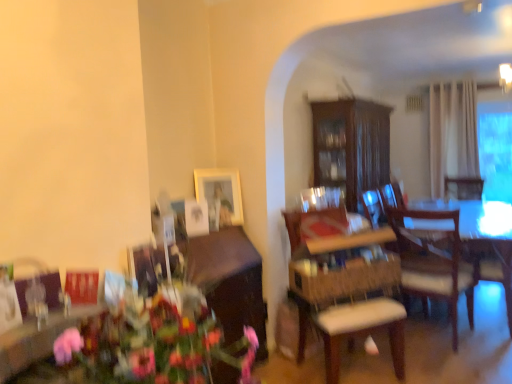
Question: Is matte wooden picture frame at upper center thinner than wooden armchair at right?

Choices:
 (A) no
 (B) yes

Answer: (B)

Question: From a real-world perspective, is matte wooden picture frame at upper center located beneath wooden armchair at right?

Choices:
 (A) no
 (B) yes

Answer: (A)

Question: Can we say matte wooden picture frame at upper center lies outside wooden armchair at right?

Choices:
 (A) no
 (B) yes

Answer: (B)

Question: Considering the relative sizes of matte wooden picture frame at upper center and wooden armchair at right in the image provided, is matte wooden picture frame at upper center bigger than wooden armchair at right?

Choices:
 (A) no
 (B) yes

Answer: (A)

Question: Is matte wooden picture frame at upper center to the right of wooden armchair at right from the viewer's perspective?

Choices:
 (A) yes
 (B) no

Answer: (B)

Question: Is matte wooden picture frame at upper center shorter than wooden armchair at right?

Choices:
 (A) yes
 (B) no

Answer: (A)

Question: Is the depth of wooden cabinet at lower left, which appears as the second cabinetry when viewed from the back, greater than that of matte wooden picture frame at upper center?

Choices:
 (A) no
 (B) yes

Answer: (A)

Question: From a real-world perspective, is wooden cabinet at lower left, the second cabinetry when ordered from top to bottom, below matte wooden picture frame at upper center?

Choices:
 (A) no
 (B) yes

Answer: (B)

Question: Does wooden cabinet at lower left, the 1th cabinetry when ordered from bottom to top, come in front of matte wooden picture frame at upper center?

Choices:
 (A) yes
 (B) no

Answer: (A)

Question: From the image's perspective, is wooden cabinet at lower left, the 1th cabinetry when ordered from bottom to top, on matte wooden picture frame at upper center?

Choices:
 (A) no
 (B) yes

Answer: (A)

Question: Considering the relative positions of wooden cabinet at lower left, marked as the 1th cabinetry in a left-to-right arrangement, and matte wooden picture frame at upper center in the image provided, is wooden cabinet at lower left, marked as the 1th cabinetry in a left-to-right arrangement, to the right of matte wooden picture frame at upper center from the viewer's perspective?

Choices:
 (A) no
 (B) yes

Answer: (A)

Question: From a real-world perspective, does wooden armchair at right sit lower than wooden cabinet at lower left, the second cabinetry when ordered from top to bottom?

Choices:
 (A) no
 (B) yes

Answer: (A)